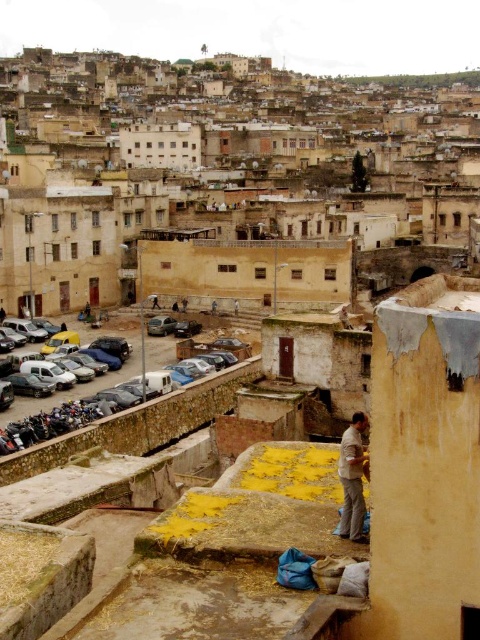
Question: Where is matte black car at left located in relation to light brown fabric at lower right in the image?

Choices:
 (A) above
 (B) below

Answer: (A)

Question: Which object appears farthest from the camera in this image?

Choices:
 (A) matte black car at left
 (B) light brown fabric at lower right

Answer: (A)

Question: Is matte black car at left behind light brown fabric at lower right?

Choices:
 (A) yes
 (B) no

Answer: (A)

Question: Is matte black car at left in front of light brown fabric at lower right?

Choices:
 (A) yes
 (B) no

Answer: (B)

Question: Which object appears farthest from the camera in this image?

Choices:
 (A) matte black car at left
 (B) light brown fabric at lower right

Answer: (A)